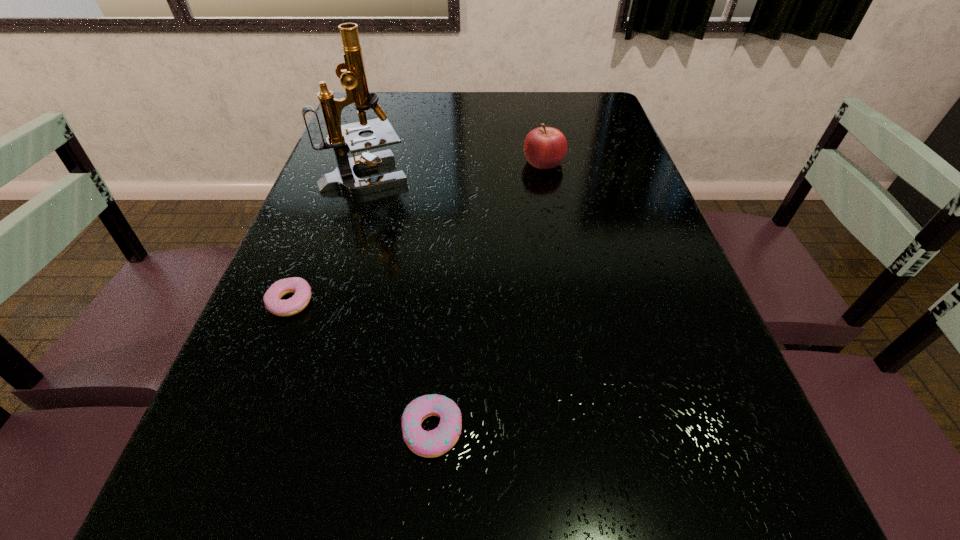
Identify the location of blank area in the image that satisfies the following two spatial constraints: 1. on the back side of the nearer doughnut; 2. on the right side of the rightmost object. (453, 161).

Locate an element on the screen. The width and height of the screenshot is (960, 540). vacant region that satisfies the following two spatial constraints: 1. at the eyepiece of the right doughnut; 2. on the left side of the microscope is located at coordinates (283, 429).

The height and width of the screenshot is (540, 960). I want to click on free space that satisfies the following two spatial constraints: 1. at the eyepiece of the microscope; 2. on the front side of the second nearest object, so click(x=324, y=302).

The width and height of the screenshot is (960, 540). Find the location of `vacant position in the image that satisfies the following two spatial constraints: 1. on the front side of the second nearest object; 2. on the left side of the nearer doughnut`. vacant position in the image that satisfies the following two spatial constraints: 1. on the front side of the second nearest object; 2. on the left side of the nearer doughnut is located at coordinates (241, 429).